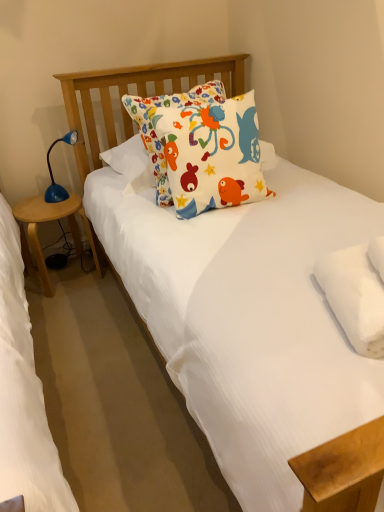
Question: Does blue plastic table lamp at left appear on the right side of wooden side table at left?

Choices:
 (A) no
 (B) yes

Answer: (B)

Question: Can you confirm if blue plastic table lamp at left is thinner than wooden side table at left?

Choices:
 (A) no
 (B) yes

Answer: (B)

Question: Is blue plastic table lamp at left positioned with its back to wooden side table at left?

Choices:
 (A) yes
 (B) no

Answer: (B)

Question: From a real-world perspective, is blue plastic table lamp at left on wooden side table at left?

Choices:
 (A) no
 (B) yes

Answer: (B)

Question: From the image's perspective, would you say blue plastic table lamp at left is shown under wooden side table at left?

Choices:
 (A) no
 (B) yes

Answer: (A)

Question: Based on their sizes in the image, would you say white cotton pillow with colorful fish designs at center, placed as the 1th pillow when sorted from back to front, is bigger or smaller than blue plastic table lamp at left?

Choices:
 (A) big
 (B) small

Answer: (A)

Question: From a real-world perspective, relative to blue plastic table lamp at left, is white cotton pillow with colorful fish designs at center, acting as the 2th pillow starting from the bottom, vertically above or below?

Choices:
 (A) above
 (B) below

Answer: (A)

Question: From the image's perspective, is white cotton pillow with colorful fish designs at center, the first pillow from the left, positioned above or below blue plastic table lamp at left?

Choices:
 (A) above
 (B) below

Answer: (B)

Question: Is point (147, 128) closer or farther from the camera than point (62, 197)?

Choices:
 (A) farther
 (B) closer

Answer: (B)

Question: From a real-world perspective, is white cotton pillow with colorful fish designs at center, acting as the 2th pillow starting from the bottom, positioned above or below wooden side table at left?

Choices:
 (A) below
 (B) above

Answer: (B)

Question: Would you say white cotton pillow with colorful fish designs at center, positioned as the second pillow in front-to-back order, is to the left or to the right of wooden side table at left in the picture?

Choices:
 (A) right
 (B) left

Answer: (A)

Question: Considering the positions of white cotton pillow with colorful fish designs at center, acting as the 2th pillow starting from the bottom, and wooden side table at left in the image, is white cotton pillow with colorful fish designs at center, acting as the 2th pillow starting from the bottom, bigger or smaller than wooden side table at left?

Choices:
 (A) big
 (B) small

Answer: (A)

Question: From their relative heights in the image, would you say white cotton pillow with colorful fish designs at center, positioned as the second pillow in right-to-left order, is taller or shorter than wooden side table at left?

Choices:
 (A) short
 (B) tall

Answer: (B)

Question: Is point (327, 280) closer or farther from the camera than point (56, 186)?

Choices:
 (A) farther
 (B) closer

Answer: (B)

Question: From a real-world perspective, is white fluffy pillow at upper right, the 2th pillow from the left, physically located above or below blue plastic table lamp at left?

Choices:
 (A) above
 (B) below

Answer: (A)